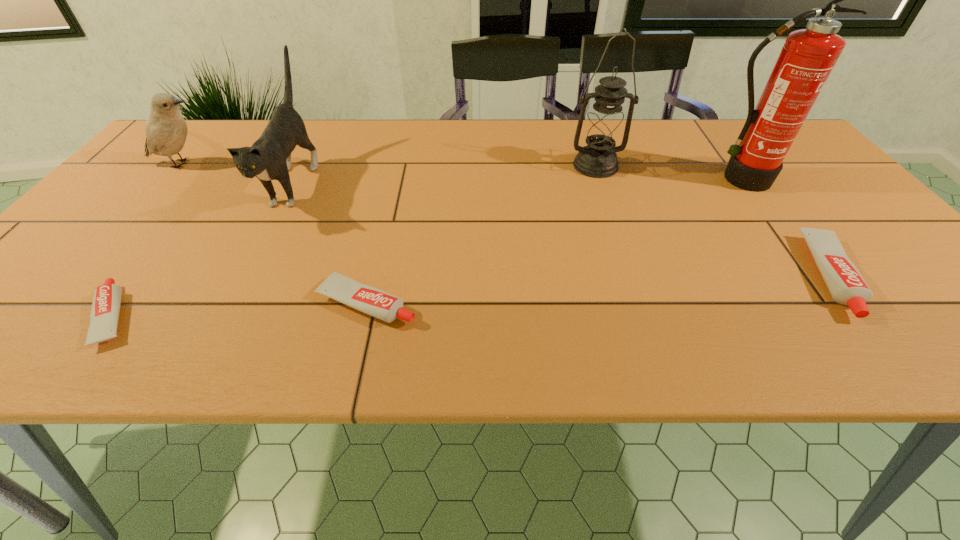
At what (x,y) coordinates should I click in order to perform the action: click on cat at the far edge. Please return your answer as a coordinate pair (x, y). This screenshot has height=540, width=960. Looking at the image, I should click on (269, 158).

You are a GUI agent. You are given a task and a screenshot of the screen. Output one action in this format:
    pyautogui.click(x=<x>, y=<y>)
    Task: Click on the oil lamp located in the far edge section of the desktop
    Image resolution: width=960 pixels, height=540 pixels.
    Given the screenshot: What is the action you would take?
    pyautogui.click(x=603, y=128)

Locate an element on the screen. object present at the left edge is located at coordinates (166, 130).

Locate an element on the screen. toothpaste located in the right edge section of the desktop is located at coordinates 846,285.

This screenshot has height=540, width=960. I want to click on fire extinguisher present at the right edge, so click(x=808, y=56).

At what (x,y) coordinates should I click in order to perform the action: click on object at the far left corner. Please return your answer as a coordinate pair (x, y). Looking at the image, I should click on (166, 130).

Image resolution: width=960 pixels, height=540 pixels. I want to click on object that is at the near right corner, so click(x=846, y=285).

Where is `blank area at the far edge`? Image resolution: width=960 pixels, height=540 pixels. blank area at the far edge is located at coordinates (660, 155).

Where is `free space at the near edge of the desktop`? The height and width of the screenshot is (540, 960). free space at the near edge of the desktop is located at coordinates (828, 308).

The width and height of the screenshot is (960, 540). In the image, there is a desktop. What are the coordinates of `vacant area at the left edge` in the screenshot? It's located at (150, 228).